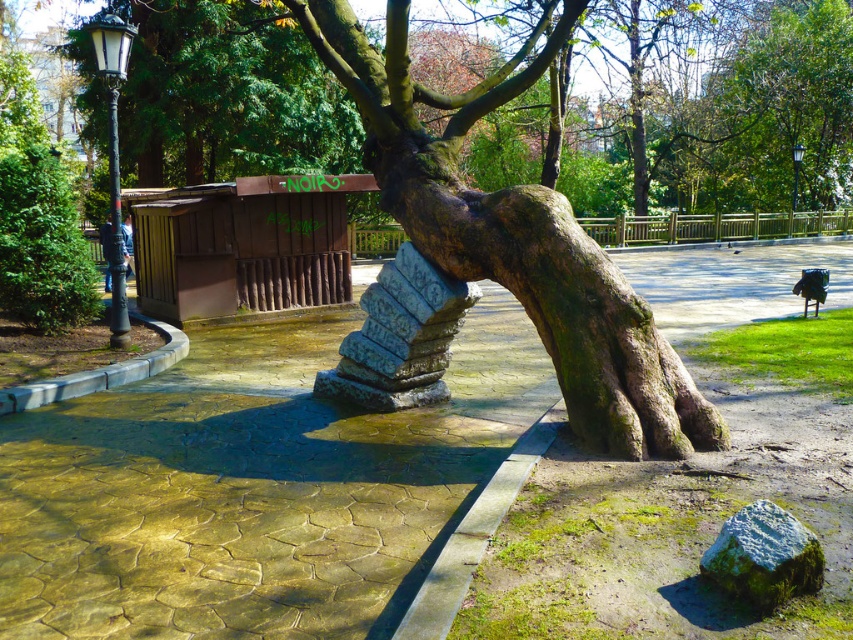
You are standing in the park and want to place a small decorative rock between the two points, point (427, 394) and point (746, 525). Which point is closer to you so you can start placing the rock there?

Point (427, 394) is closer to you than point (746, 525), so you should start placing the rock near point (427, 394).

You are a park visitor standing near the green mossy rock at lower right. Looking up, you see the green mossy bark tree trunk at center. Which object is higher in the scene?

The green mossy bark tree trunk at center is higher than the green mossy rock at lower right.

You are a gardener planning to place a decorative stone to the right of the green mossy bark tree trunk at center. Based on the current arrangement, where should you place it to maintain alignment with the existing green mossy rock at lower right?

The green mossy bark tree trunk at center is positioned on the left side of green mossy rock at lower right, so placing the decorative stone to the right of the green mossy bark tree trunk at center would align it with the existing green mossy rock at lower right.